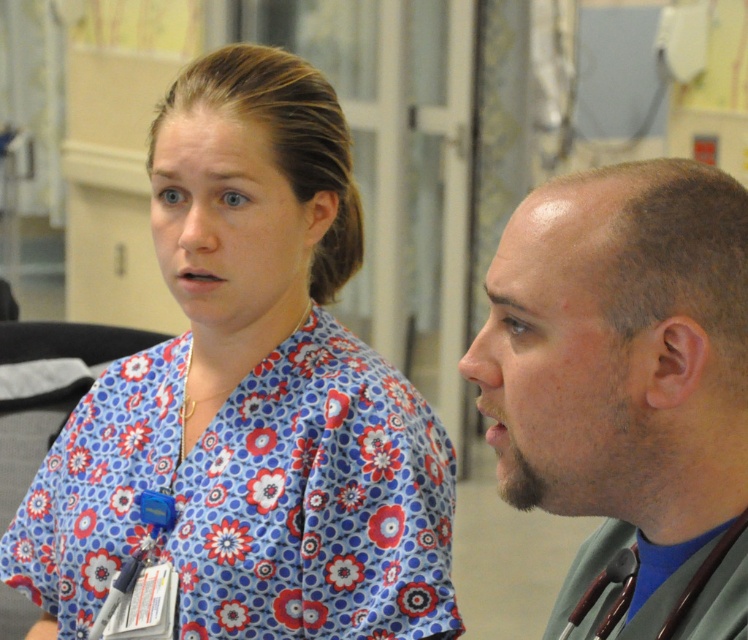
You are a patient in a hospital room and see the floral print scrubs at center and the gray stethoscope at right. Which object is closer to your left side?

The floral print scrubs at center is to the left of gray stethoscope at right, so the floral print scrubs at center is closer to your left side.

You are a patient in this hospital room and need to locate two specific points marked in the scene. The first point is at coordinates point (334, 282) and the second is at point (542, 186). From your perspective, which point is closer to the back wall of the room?

Point (334, 282) is behind point (542, 186), so it is closer to the back wall of the room.

You are a patient in a hospital room and need to identify which object is taller between the floral print scrubs at center and the gray stethoscope at right. Based on the scene, which one is taller?

The floral print scrubs at center is taller than the gray stethoscope at right according to the description.